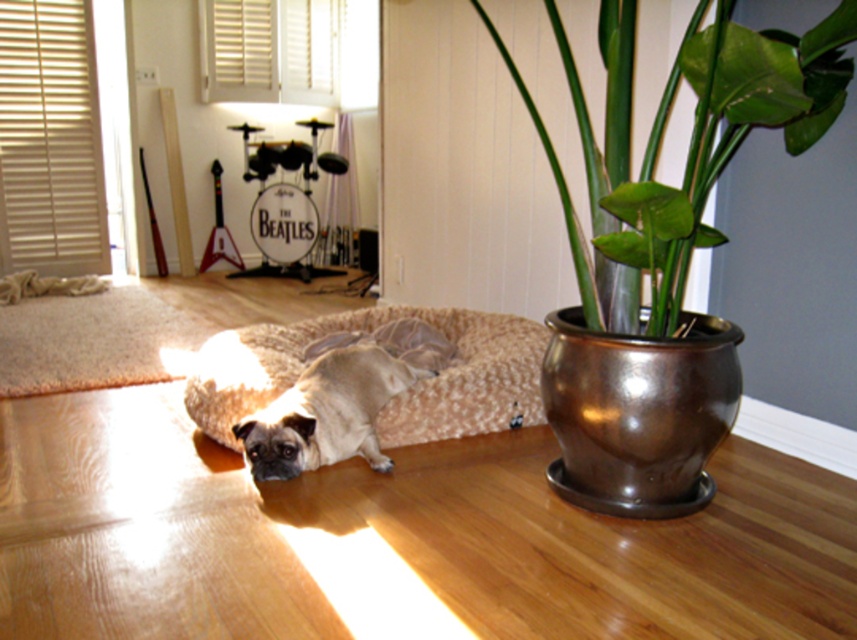
Identify the location of beige plush dog bed at center. (393, 400).

Which is behind, point (243, 387) or point (318, 456)?

Point (243, 387)

Which is in front, point (219, 419) or point (355, 452)?

Point (355, 452) is in front.

Identify the location of beige plush dog bed at center. This screenshot has height=640, width=857. (393, 400).

Does green glossy pot at right have a lesser width compared to beige plush dog bed at center?

Indeed, green glossy pot at right has a lesser width compared to beige plush dog bed at center.

The height and width of the screenshot is (640, 857). What are the coordinates of `green glossy pot at right` in the screenshot? It's located at (690, 141).

Which is below, green glossy pot at right or fuzzy beige dog at center?

Positioned lower is fuzzy beige dog at center.

Between green glossy pot at right and fuzzy beige dog at center, which one has less height?

fuzzy beige dog at center is shorter.

Locate an element on the screen. Image resolution: width=857 pixels, height=640 pixels. green glossy pot at right is located at coordinates (690, 141).